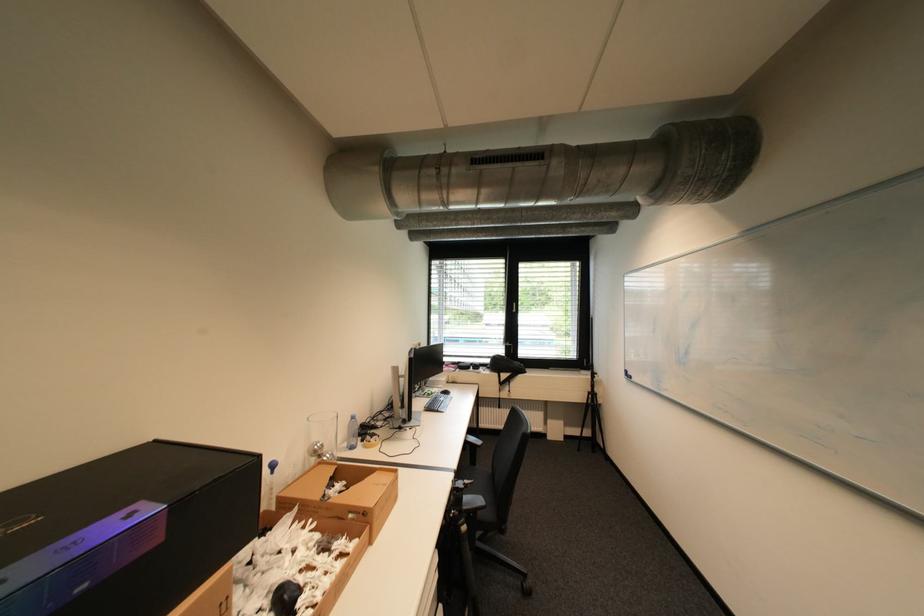
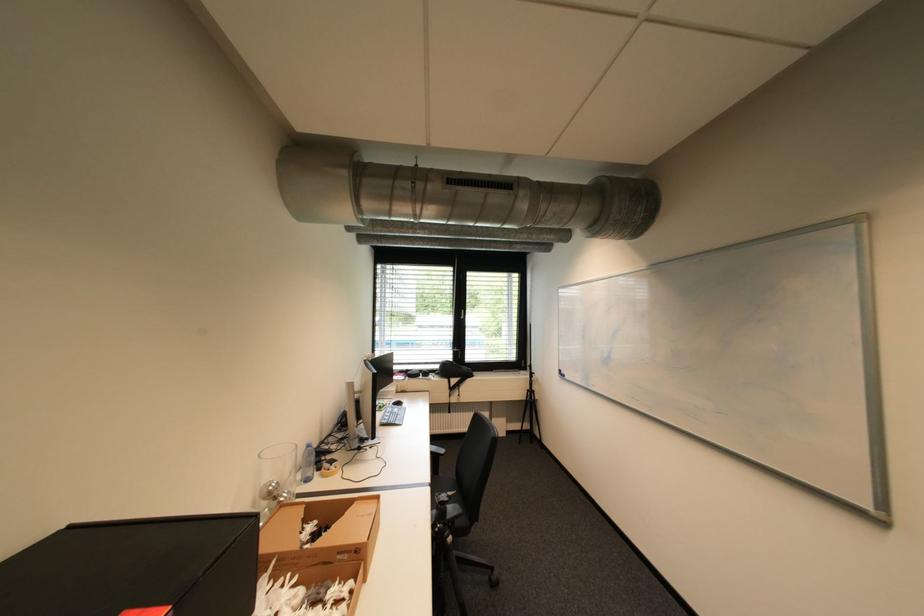
In the second image, find the point that corresponds to [472,528] in the first image.

(458, 540)